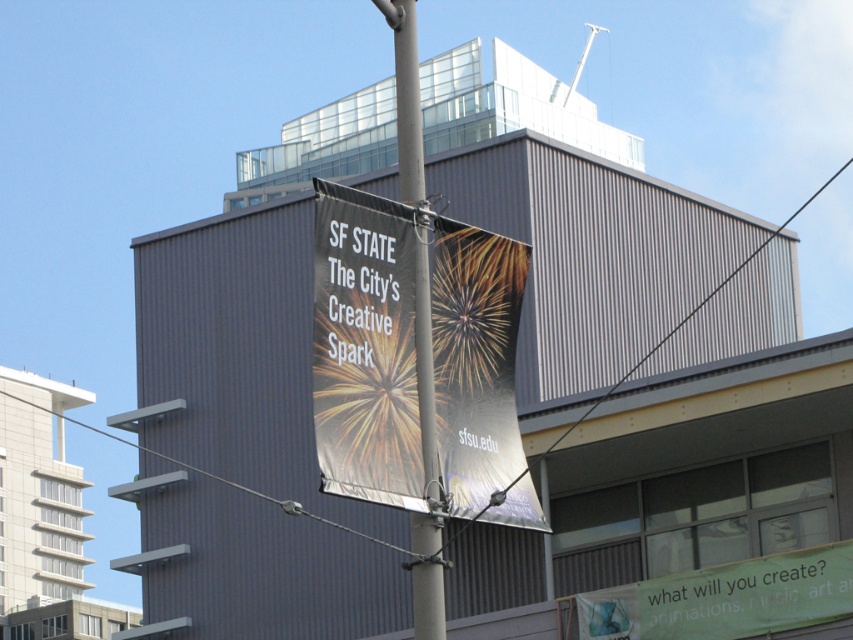
Question: Is green fabric banner at lower right to the right of metallic pole at center from the viewer's perspective?

Choices:
 (A) yes
 (B) no

Answer: (A)

Question: Considering the real-world distances, which object is farthest from the metallic pole at center?

Choices:
 (A) green fabric banner at lower right
 (B) metallic banner at center

Answer: (A)

Question: Which point appears closest to the camera in this image?

Choices:
 (A) (320, 372)
 (B) (811, 556)

Answer: (A)

Question: Can you confirm if green fabric banner at lower right is positioned below metallic pole at center?

Choices:
 (A) no
 (B) yes

Answer: (B)

Question: Among these objects, which one is nearest to the camera?

Choices:
 (A) metallic pole at center
 (B) green fabric banner at lower right

Answer: (A)

Question: Does metallic banner at center have a greater width compared to green fabric banner at lower right?

Choices:
 (A) no
 (B) yes

Answer: (A)